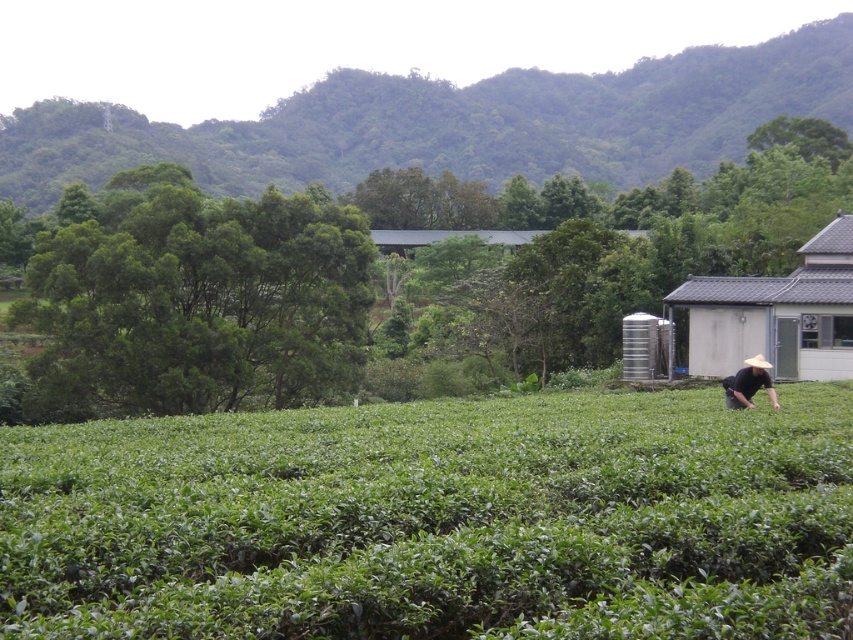
Question: Among these objects, which one is farthest from the camera?

Choices:
 (A) green leafy field at lower center
 (B) black straw hat at lower right

Answer: (B)

Question: Observing the image, what is the correct spatial positioning of green leafy field at lower center in reference to black straw hat at lower right?

Choices:
 (A) below
 (B) above

Answer: (A)

Question: Which of the following is the farthest from the observer?

Choices:
 (A) green leafy field at lower center
 (B) white textured hut at right
 (C) black straw hat at lower right

Answer: (B)

Question: Can you confirm if green leafy field at lower center is bigger than white textured hut at right?

Choices:
 (A) no
 (B) yes

Answer: (A)

Question: Which point is farther to the camera?

Choices:
 (A) white textured hut at right
 (B) black straw hat at lower right

Answer: (A)

Question: Can you confirm if white textured hut at right is thinner than black straw hat at lower right?

Choices:
 (A) no
 (B) yes

Answer: (A)